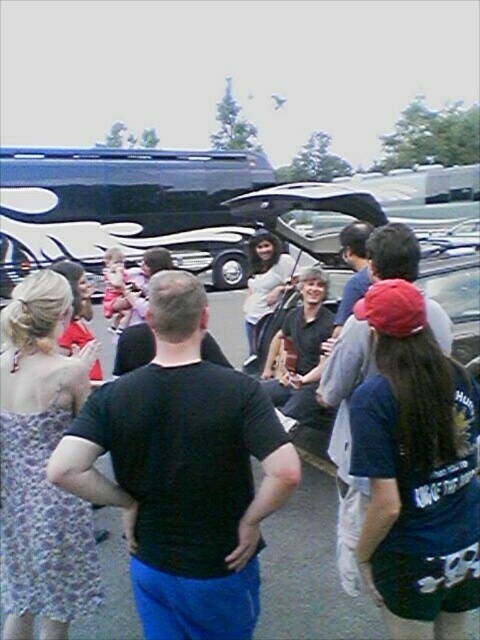
Can you confirm if black matte shirt at center is positioned to the left of dark blue fabric shirt at center?

Yes, black matte shirt at center is to the left of dark blue fabric shirt at center.

What do you see at coordinates (183, 474) in the screenshot?
I see `black matte shirt at center` at bounding box center [183, 474].

Is point (224, 413) less distant than point (396, 448)?

Yes, it is in front of point (396, 448).

You are a GUI agent. You are given a task and a screenshot of the screen. Output one action in this format:
    pyautogui.click(x=<x>, y=<y>)
    Task: Click on the black matte shirt at center
    Image resolution: width=480 pixels, height=640 pixels.
    Given the screenshot: What is the action you would take?
    pyautogui.click(x=183, y=474)